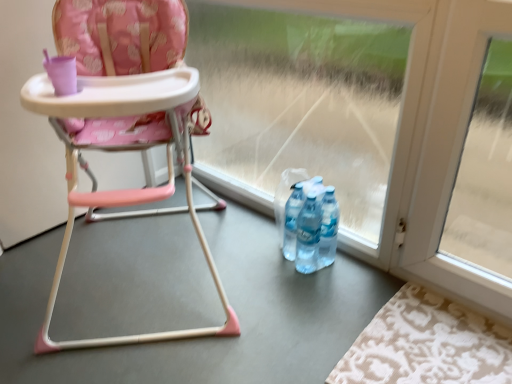
The width and height of the screenshot is (512, 384). Find the location of `vacant area situated to the left side of beige damask rug at lower right`. vacant area situated to the left side of beige damask rug at lower right is located at coordinates (285, 324).